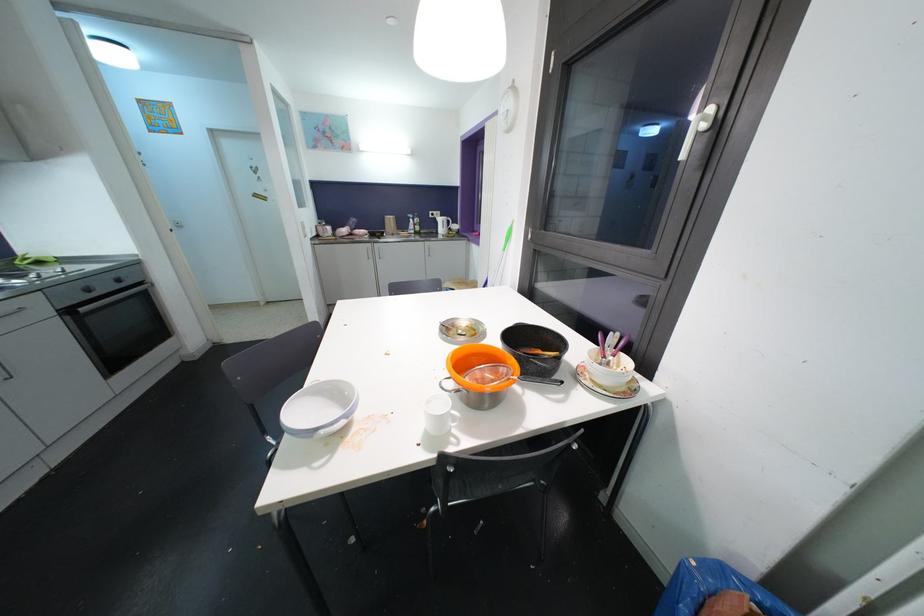
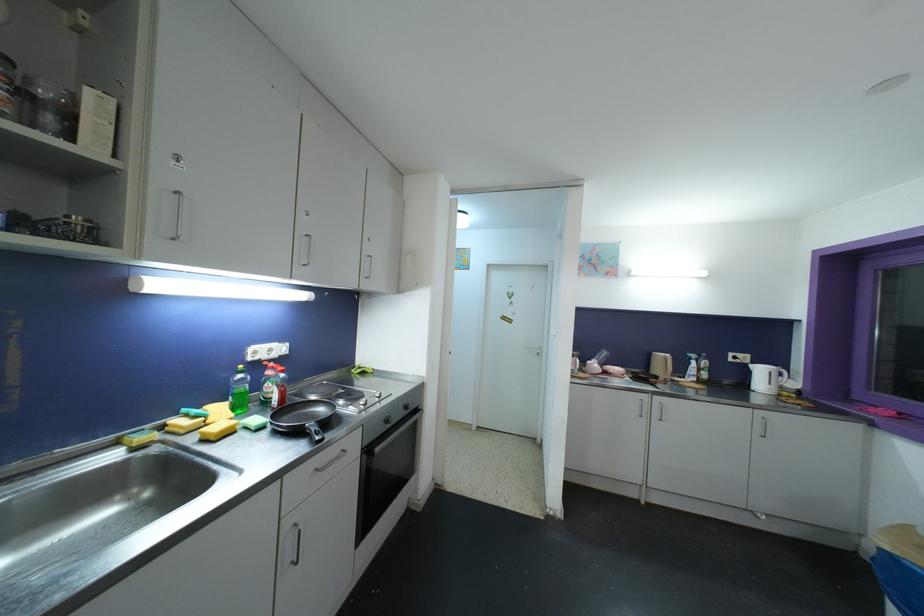
In the second image, find the point that corresponds to [444,223] in the first image.

(763, 373)